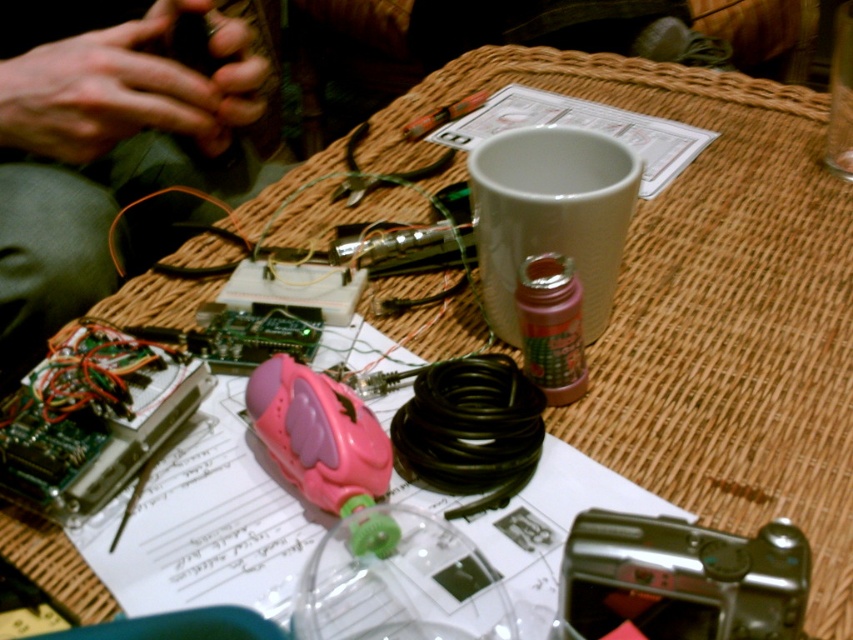
You are a robot trying to navigate from the starting point to the endpoint. The starting point is at point (165, 60) and the endpoint is at point (473, 92). Can you reach the endpoint without moving backward?

Point (165, 60) is in front of point (473, 92), so yes, the robot can reach the endpoint without moving backward since it can move forward from the starting point to the endpoint.

You are a hobbyist working on a project and need to access the metallic silver tool at upper center. Is the green fabric hands at upper left blocking your access to it?

The green fabric hands at upper left is positioned under the metallic silver tool at upper center, so it is not blocking access to the tool.

You are setting up a DIY project and need to place the green fabric hands at upper left and the black plastic camera at lower right on a shelf. The shelf has limited height. Which object should you place first to ensure it fits?

The black plastic camera at lower right is shorter than the green fabric hands at upper left, so you should place the green fabric hands at upper left first to ensure it fits on the shelf.